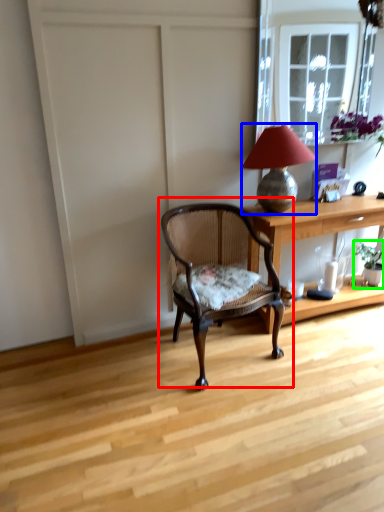
Question: Based on their relative distances, which object is nearer to chair (highlighted by a red box)? Choose from lamp (highlighted by a blue box) and houseplant (highlighted by a green box).

Choices:
 (A) lamp
 (B) houseplant

Answer: (A)